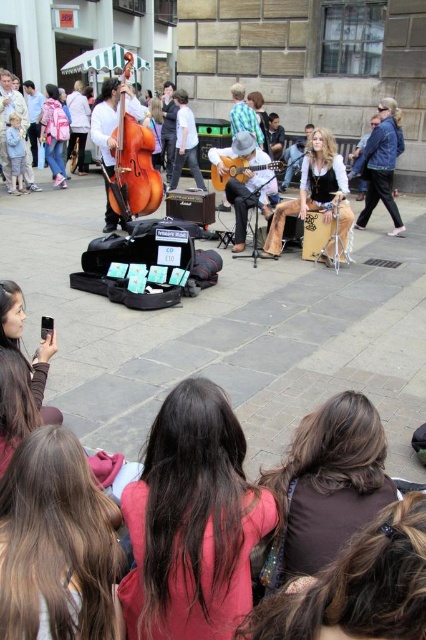
Can you confirm if blue leather jacket at right is smaller than acoustic guitar at center?

No, blue leather jacket at right is not smaller than acoustic guitar at center.

Based on the photo, does blue leather jacket at right have a greater height compared to acoustic guitar at center?

Yes.

The image size is (426, 640). Identify the location of blue leather jacket at right. (380, 164).

Does leather pants at center have a larger size compared to wooden acoustic guitar at center?

Indeed, leather pants at center has a larger size compared to wooden acoustic guitar at center.

Which is below, leather pants at center or wooden acoustic guitar at center?

leather pants at center

Is point (333, 253) behind point (235, 145)?

No.

The height and width of the screenshot is (640, 426). Find the location of `leather pants at center`. leather pants at center is located at coordinates (316, 193).

Who is lower down, blue leather jacket at right or wooden acoustic guitar at center?

wooden acoustic guitar at center is lower down.

The height and width of the screenshot is (640, 426). Identify the location of blue leather jacket at right. (380, 164).

This screenshot has width=426, height=640. Find the location of `blue leather jacket at right`. blue leather jacket at right is located at coordinates (380, 164).

At what (x,y) coordinates should I click in order to perform the action: click on blue leather jacket at right. Please return your answer as a coordinate pair (x, y). Looking at the image, I should click on (380, 164).